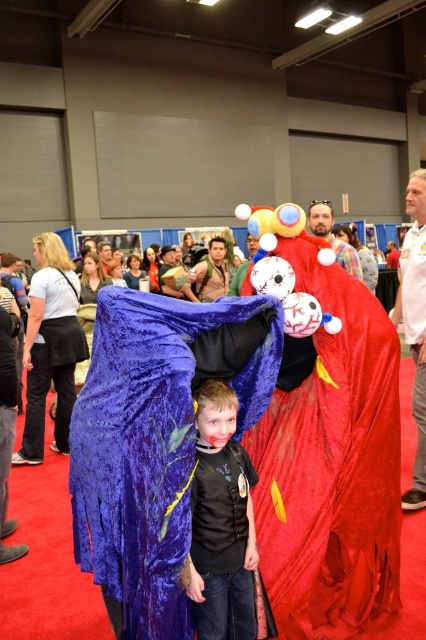
You are standing at the entrance of the convention hall and see the point marked at coordinates (250,456). What object is located at that point?

The point at coordinates (250,456) indicates the velvet blue cape at center.

You are standing at the entrance of the convention hall and want to take a photo of the velvet blue cape at center. According to the coordinates provided, where should you aim your camera?

The velvet blue cape at center is located at point (x=250, y=456), so you should aim your camera at those coordinates to capture it.